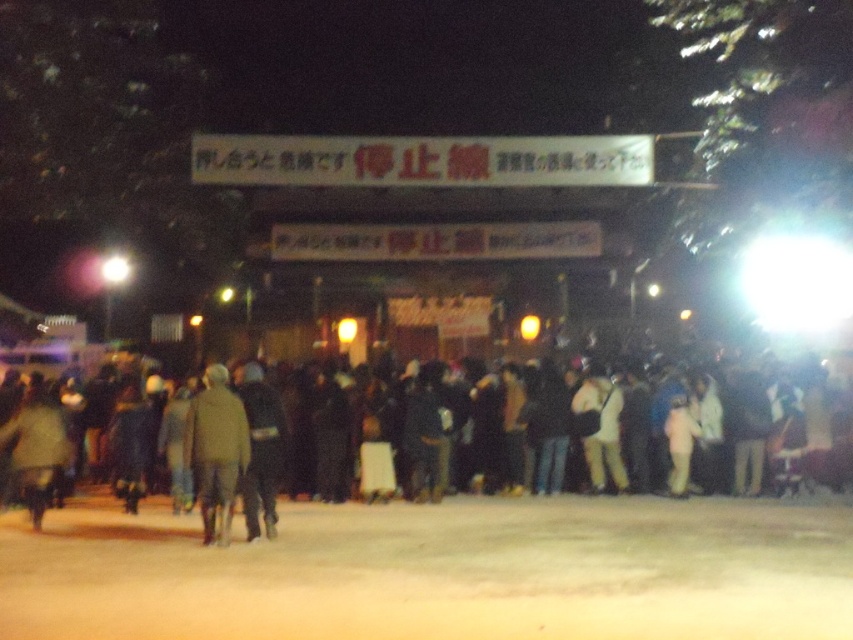
You are a photographer trying to capture a clear shot of the dark green jacket at center. However, the black fabric crowd at center is blocking your view. Can you estimate whether the crowd is bigger than the jacket in this scene?

The black fabric crowd at center is larger in size than the dark green jacket at center, so the crowd is indeed bigger and might be blocking the view of the jacket.

You are standing in the nighttime scene and want to reach the building entrance. There is a black fabric crowd at center and a dark green jacket at center in your way. Which object is closer to you that you need to navigate around first?

The black fabric crowd at center is closer to you than the dark green jacket at center, so you need to navigate around the black fabric crowd at center first.

You are a photographer trying to capture a clear shot of the dark green jacket at center without the black fabric crowd at center blocking it. Is there a way to adjust your position to achieve this?

The black fabric crowd at center is positioned under the dark green jacket at center, so moving your camera angle upwards might allow you to capture the jacket without obstruction from the crowd.